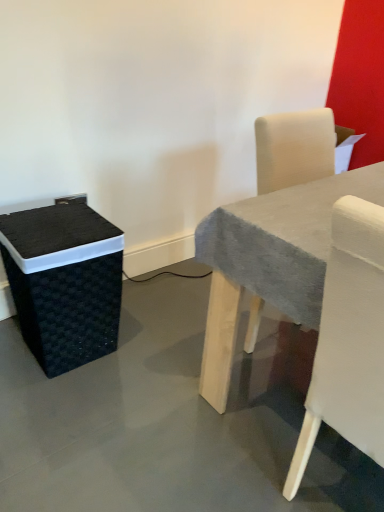
Question: Is black woven basket at left facing away from white fabric chair at right?

Choices:
 (A) yes
 (B) no

Answer: (B)

Question: Is black woven basket at left smaller than white fabric chair at right?

Choices:
 (A) yes
 (B) no

Answer: (A)

Question: Considering the relative sizes of black woven basket at left and white fabric chair at right in the image provided, is black woven basket at left shorter than white fabric chair at right?

Choices:
 (A) no
 (B) yes

Answer: (B)

Question: Is black woven basket at left positioned in front of white fabric chair at right?

Choices:
 (A) yes
 (B) no

Answer: (B)

Question: Is black woven basket at left far away from white fabric chair at right?

Choices:
 (A) no
 (B) yes

Answer: (A)

Question: Can you confirm if black woven basket at left is wider than white fabric chair at right?

Choices:
 (A) no
 (B) yes

Answer: (A)

Question: Does black woven basket at left have a lesser width compared to smooth gray table at center?

Choices:
 (A) no
 (B) yes

Answer: (B)

Question: Is black woven basket at left next to smooth gray table at center?

Choices:
 (A) yes
 (B) no

Answer: (B)

Question: Can you confirm if black woven basket at left is wider than smooth gray table at center?

Choices:
 (A) yes
 (B) no

Answer: (B)

Question: Considering the relative positions of black woven basket at left and smooth gray table at center in the image provided, is black woven basket at left in front of smooth gray table at center?

Choices:
 (A) no
 (B) yes

Answer: (A)

Question: Would you say black woven basket at left contains smooth gray table at center?

Choices:
 (A) no
 (B) yes

Answer: (A)

Question: From the image's perspective, does black woven basket at left appear lower than smooth gray table at center?

Choices:
 (A) yes
 (B) no

Answer: (A)

Question: Is smooth gray table at center at the left side of black woven basket at left?

Choices:
 (A) yes
 (B) no

Answer: (B)